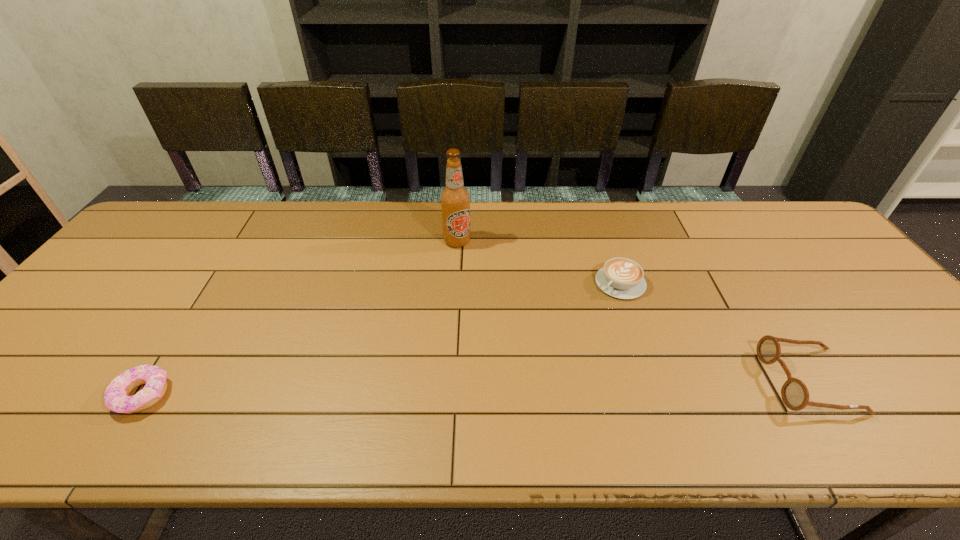
Locate an element on the screen. The image size is (960, 540). free spot between the third nearest object and the second object from left to right is located at coordinates (539, 262).

Find the location of a particular element. This screenshot has height=540, width=960. unoccupied position between the spectacles and the tallest object is located at coordinates (634, 311).

Where is `the second closest object to the farthest object`? Image resolution: width=960 pixels, height=540 pixels. the second closest object to the farthest object is located at coordinates (116, 396).

Locate which object ranks second in proximity to the third shortest object. Please provide its 2D coordinates. Your answer should be formatted as a tuple, i.e. [(x, y)], where the tuple contains the x and y coordinates of a point satisfying the conditions above.

[(455, 199)]

Where is `vacant space that satisfies the following two spatial constraints: 1. on the front side of the beer bottle; 2. on the front-facing side of the third shortest object`? vacant space that satisfies the following two spatial constraints: 1. on the front side of the beer bottle; 2. on the front-facing side of the third shortest object is located at coordinates (448, 381).

The height and width of the screenshot is (540, 960). In order to click on blank space that satisfies the following two spatial constraints: 1. on the front side of the spectacles; 2. on the front-facing side of the tallest object in this screenshot , I will do `click(448, 381)`.

This screenshot has width=960, height=540. Find the location of `free space that satisfies the following two spatial constraints: 1. on the front side of the farthest object; 2. on the front-facing side of the rightmost object`. free space that satisfies the following two spatial constraints: 1. on the front side of the farthest object; 2. on the front-facing side of the rightmost object is located at coordinates click(x=448, y=381).

Identify the location of vacant point that satisfies the following two spatial constraints: 1. on the back side of the doughnut; 2. on the front-facing side of the rightmost object. The image size is (960, 540). (152, 381).

The width and height of the screenshot is (960, 540). I want to click on vacant space that satisfies the following two spatial constraints: 1. on the back side of the leftmost object; 2. on the front-facing side of the rightmost object, so click(x=152, y=381).